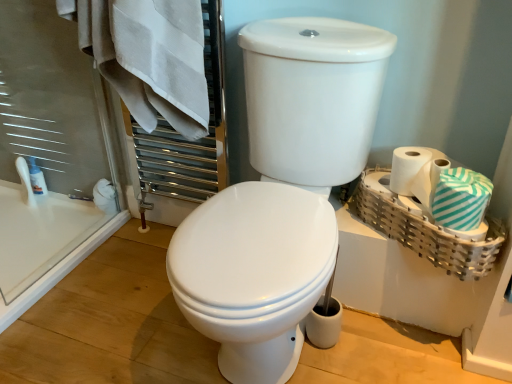
In order to click on free space in front of white matte toilet paper at right in this screenshot , I will do `click(441, 220)`.